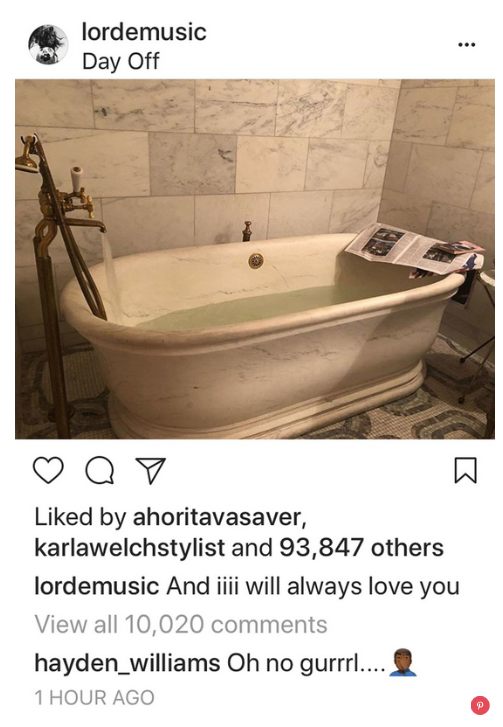
What are the coordinates of `water in tub` in the screenshot? It's located at (269, 310).